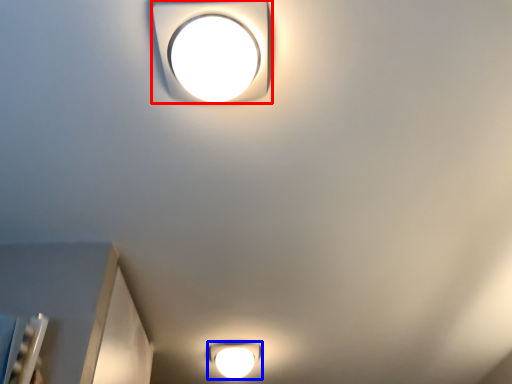
Question: Among these objects, which one is nearest to the camera, lamp (highlighted by a red box) or lamp (highlighted by a blue box)?

Choices:
 (A) lamp
 (B) lamp

Answer: (A)